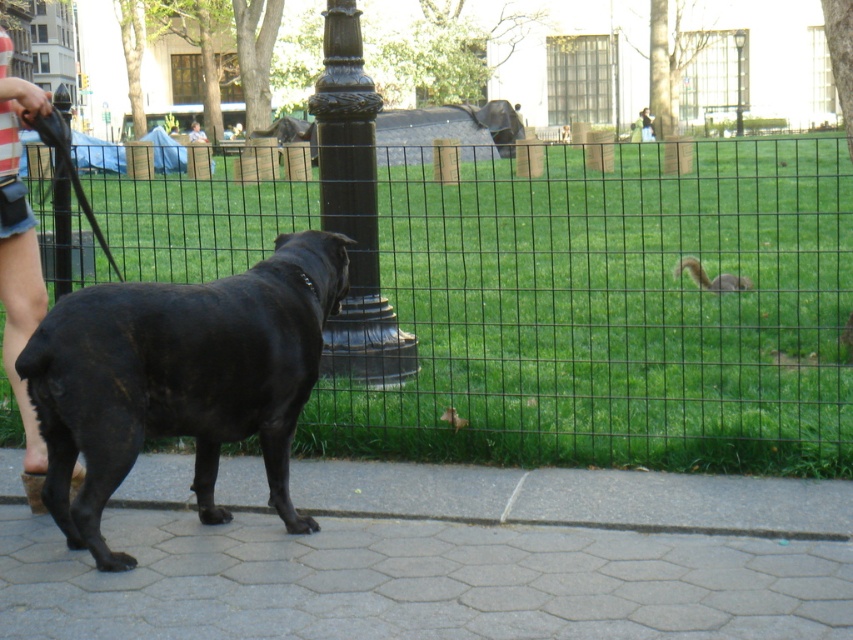
You are a photographer standing at the center of the paved area. You want to take a picture of the gray furry squirrel at center right. Where should you position yourself to capture it in the frame?

The gray furry squirrel at center right is located at the 2D coordinates point (712,278), so you should position yourself at the center of the paved area and aim your camera towards the center right direction to capture it in the frame.

You are a photographer trying to capture the striped fabric leg at lower left and the metallic glass lamp post at upper center in the same frame. Which object will appear larger in your photo?

The striped fabric leg at lower left will appear larger in the photo because it is closer to the viewer than the metallic glass lamp post at upper center.

You are standing in the park and notice both the metallic glass lamp post at upper center and the light brown hair at upper center. Which object is positioned to the right when viewed from your perspective?

The metallic glass lamp post at upper center is to the right of the light brown hair at upper center.